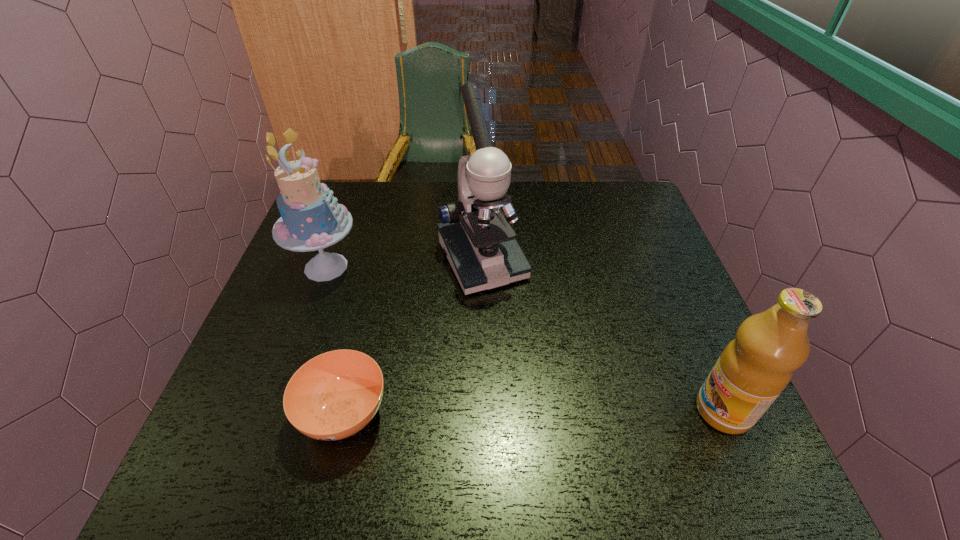
Where is `the shortest object`? The height and width of the screenshot is (540, 960). the shortest object is located at coordinates (334, 395).

This screenshot has width=960, height=540. Find the location of `the rightmost object`. the rightmost object is located at coordinates (754, 368).

The height and width of the screenshot is (540, 960). In order to click on olive oil in this screenshot , I will do `click(754, 368)`.

Locate an element on the screen. This screenshot has width=960, height=540. the third object from left to right is located at coordinates (477, 239).

Locate an element on the screen. Image resolution: width=960 pixels, height=540 pixels. cake is located at coordinates (311, 219).

Where is `vacant space located on the back of the shortest object`? The width and height of the screenshot is (960, 540). vacant space located on the back of the shortest object is located at coordinates (360, 348).

You are a GUI agent. You are given a task and a screenshot of the screen. Output one action in this format:
    pyautogui.click(x=<x>, y=<y>)
    Task: Click on the free space located on the label of the olive oil
    This screenshot has height=540, width=960.
    Given the screenshot: What is the action you would take?
    pyautogui.click(x=524, y=411)

This screenshot has height=540, width=960. I want to click on vacant space located 0.260m on the label of the olive oil, so click(564, 411).

The image size is (960, 540). In order to click on blank space located on the label of the olive oil in this screenshot , I will do `click(544, 411)`.

Image resolution: width=960 pixels, height=540 pixels. Identify the location of free space located at the eyepiece of the second object from right to left. (525, 340).